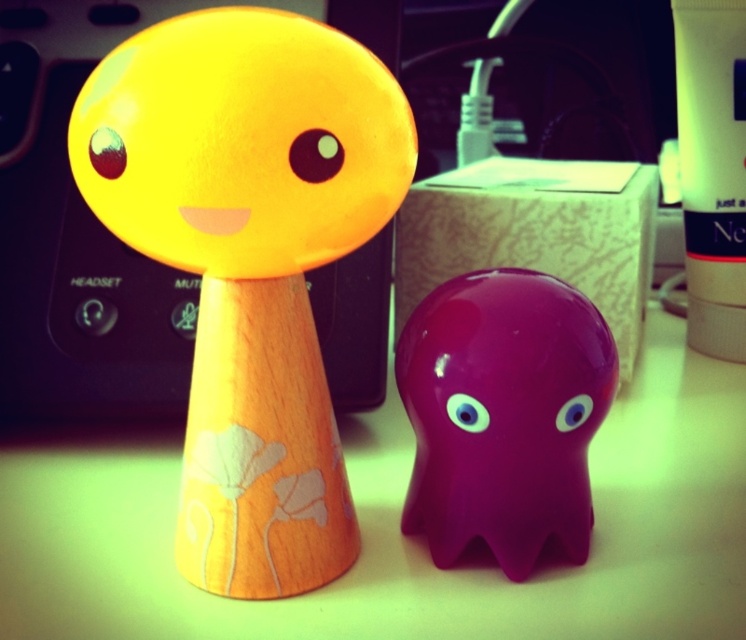
Question: Can you confirm if wooden yellow figurine at center is thinner than glossy plastic eye at center?

Choices:
 (A) no
 (B) yes

Answer: (A)

Question: Which object appears closest to the camera in this image?

Choices:
 (A) matte black eye at upper center
 (B) matte black eye at upper left
 (C) blue glossy eye at center
 (D) wooden yellow figurine at center

Answer: (D)

Question: Which of these objects is positioned farthest from the blue glossy eye at center?

Choices:
 (A) matte black eye at upper center
 (B) glossy plastic ghost at center
 (C) wooden yellow figurine at center

Answer: (C)

Question: Considering the real-world distances, which object is closest to the blue glossy eye at center?

Choices:
 (A) matte black eye at upper left
 (B) glossy plastic eye at center
 (C) wooden yellow figurine at center

Answer: (B)

Question: Can you confirm if glossy plastic ghost at center is wider than matte black eye at upper left?

Choices:
 (A) yes
 (B) no

Answer: (A)

Question: Can you confirm if glossy plastic ghost at center is smaller than matte black eye at upper center?

Choices:
 (A) yes
 (B) no

Answer: (B)